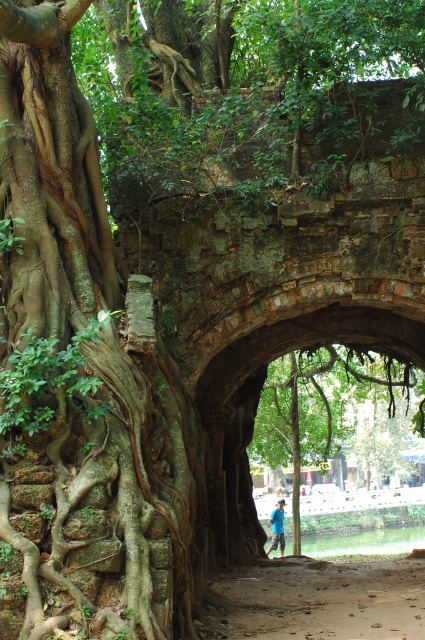
Question: Based on their relative distances, which object is farther from the blue fabric shirt at center?

Choices:
 (A) green rough bark tree at center
 (B) brown dirt path at center

Answer: (B)

Question: Among these objects, which one is farthest from the camera?

Choices:
 (A) brown rough bark banyan tree at left
 (B) brown dirt path at center
 (C) green rough bark tree at center
 (D) blue fabric shirt at center

Answer: (D)

Question: Does brown rough bark banyan tree at left appear on the right side of green rough bark tree at center?

Choices:
 (A) yes
 (B) no

Answer: (B)

Question: Estimate the real-world distances between objects in this image. Which object is closer to the brown rough bark banyan tree at left?

Choices:
 (A) blue fabric shirt at center
 (B) brown dirt path at center
 (C) green rough bark tree at center

Answer: (B)

Question: Is green rough bark tree at center below blue fabric shirt at center?

Choices:
 (A) no
 (B) yes

Answer: (A)

Question: Considering the relative positions of green rough bark tree at center and blue fabric shirt at center in the image provided, where is green rough bark tree at center located with respect to blue fabric shirt at center?

Choices:
 (A) below
 (B) above

Answer: (B)